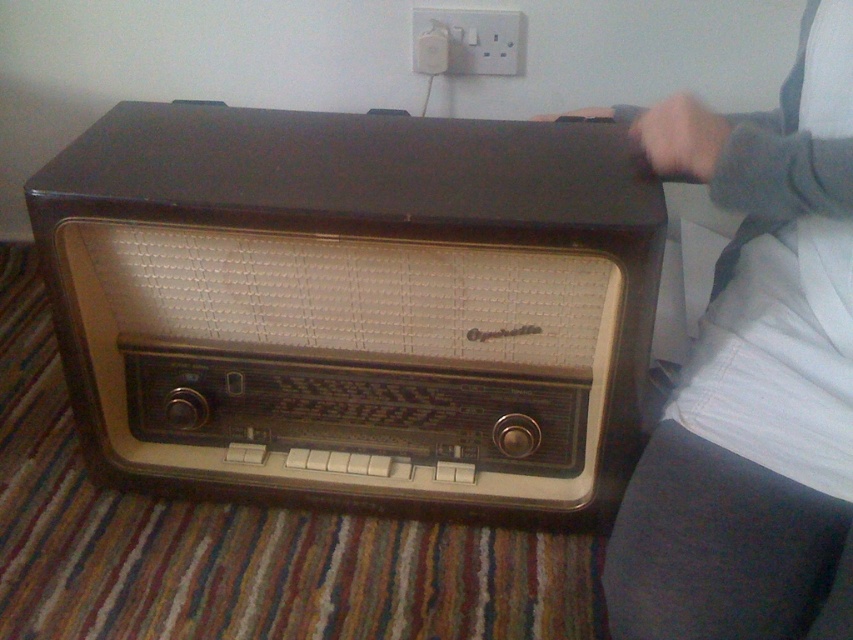
You are trying to place a new decorative item on the striped carpet. The item is 15 cm wide. You see the matte black radio at center and the gray fabric at upper right. Can you determine if the space between them is wide enough for your item?

The matte black radio at center might be wider than gray fabric at upper right, so the space between them may not be sufficient for the 15 cm wide item. Check the exact measurements before placing it.

Looking at this image, you are setting up a display and need to place a small figurine on top of the matte black radio at center. Can you confirm if there is enough vertical space between the radio and the gray fabric at upper right to place it?

The matte black radio at center has a lesser height compared to gray fabric at upper right, so there is enough vertical space between them to place the small figurine on top of the radio.

You are standing in a room with a vintage radio setup. You need to place a small plant pot between the matte black radio at center and the gray fabric at upper right. Based on their positions, where should you place the plant pot?

The matte black radio at center is located above the gray fabric at upper right, so you should place the plant pot between them by positioning it below the matte black radio at center and above the gray fabric at upper right.